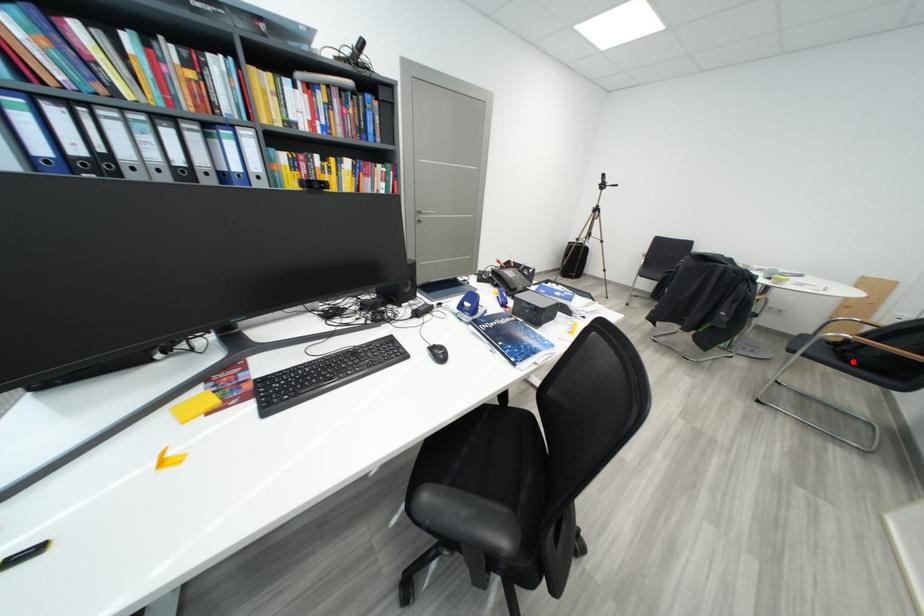
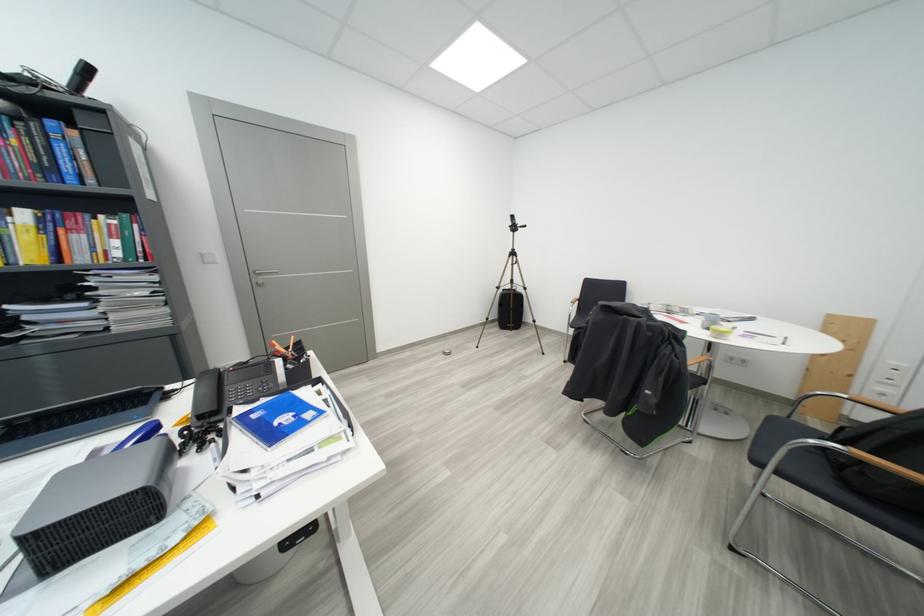
Question: I am providing you with two images of the same scene from different viewpoints. A red point is shown in image1. For the corresponding object point in image2, is it positioned nearer or farther from the camera?

Choices:
 (A) Nearer
 (B) Farther

Answer: (A)